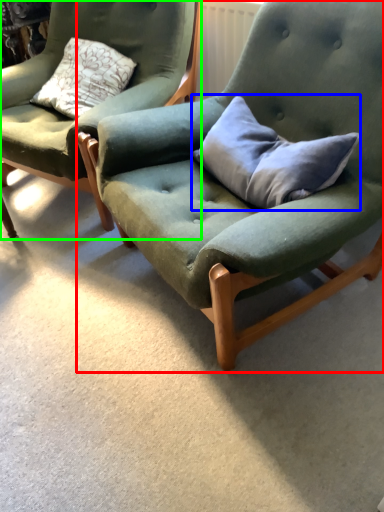
Question: Considering the real-world distances, which object is farthest from chair (highlighted by a red box)? pillow (highlighted by a blue box) or chair (highlighted by a green box)?

Choices:
 (A) pillow
 (B) chair

Answer: (B)